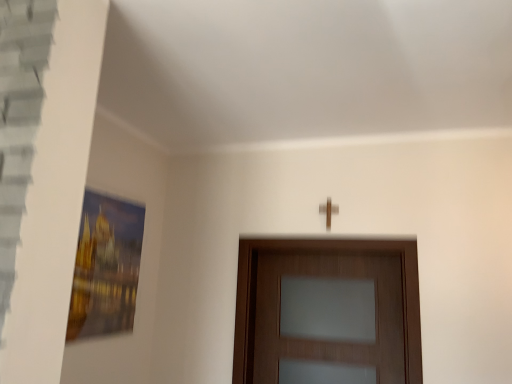
Question: Visually, is wooden door at center positioned to the left or to the right of wooden cross at upper center?

Choices:
 (A) left
 (B) right

Answer: (A)

Question: Would you say wooden door at center is inside or outside wooden cross at upper center?

Choices:
 (A) outside
 (B) inside

Answer: (A)

Question: From the image's perspective, is wooden door at center positioned above or below wooden cross at upper center?

Choices:
 (A) above
 (B) below

Answer: (B)

Question: Looking at the image, does wooden cross at upper center seem bigger or smaller compared to wooden door at center?

Choices:
 (A) big
 (B) small

Answer: (B)

Question: In terms of width, does wooden cross at upper center look wider or thinner when compared to wooden door at center?

Choices:
 (A) thin
 (B) wide

Answer: (A)

Question: From the image's perspective, is wooden cross at upper center positioned above or below wooden door at center?

Choices:
 (A) below
 (B) above

Answer: (B)

Question: Would you say wooden cross at upper center is to the left or to the right of wooden door at center in the picture?

Choices:
 (A) left
 (B) right

Answer: (B)